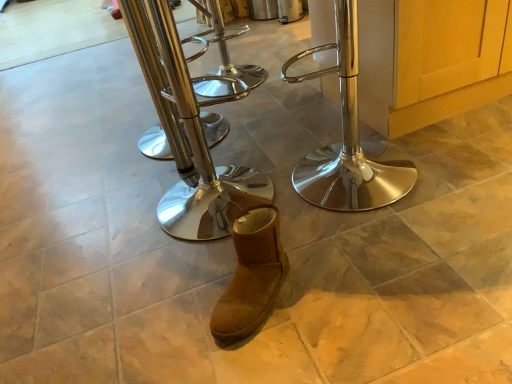
Question: Which direction should I rotate to face polished chrome stool at center, the second step stool when ordered from left to right, — up or down?

Choices:
 (A) up
 (B) down

Answer: (A)

Question: Is polished chrome stool at center, the second step stool viewed from the right, facing towards polished metal bar stool at center, which is the 1th step stool from left to right?

Choices:
 (A) no
 (B) yes

Answer: (A)

Question: Considering the relative positions of polished chrome stool at center, the second step stool viewed from the right, and polished metal bar stool at center, the third step stool viewed from the right, in the image provided, is polished chrome stool at center, the second step stool viewed from the right, to the left of polished metal bar stool at center, the third step stool viewed from the right, from the viewer's perspective?

Choices:
 (A) yes
 (B) no

Answer: (B)

Question: From the image's perspective, would you say polished chrome stool at center, the second step stool viewed from the right, is shown under polished metal bar stool at center, which is the 1th step stool from left to right?

Choices:
 (A) yes
 (B) no

Answer: (A)

Question: Is polished chrome stool at center, the second step stool when ordered from left to right, bigger than polished metal bar stool at center, which is the 1th step stool from left to right?

Choices:
 (A) no
 (B) yes

Answer: (A)

Question: Are polished chrome stool at center, the second step stool viewed from the right, and polished metal bar stool at center, the third step stool viewed from the right, located far from each other?

Choices:
 (A) yes
 (B) no

Answer: (B)

Question: Is polished metal bar stool at center, which is the 1th step stool from left to right, inside polished chrome stool at center, the second step stool when ordered from left to right?

Choices:
 (A) no
 (B) yes

Answer: (A)

Question: Does polished chrome stool at center, which appears as the 1th step stool when viewed from the right, have a smaller size compared to brown suede boot at center?

Choices:
 (A) yes
 (B) no

Answer: (B)

Question: Can you confirm if polished chrome stool at center, which ranks as the 3th step stool in left-to-right order, is wider than brown suede boot at center?

Choices:
 (A) yes
 (B) no

Answer: (A)

Question: Can you see polished chrome stool at center, which appears as the 1th step stool when viewed from the right, touching brown suede boot at center?

Choices:
 (A) yes
 (B) no

Answer: (B)

Question: From a real-world perspective, is polished chrome stool at center, which appears as the 1th step stool when viewed from the right, physically below brown suede boot at center?

Choices:
 (A) yes
 (B) no

Answer: (B)

Question: Is polished chrome stool at center, which appears as the 1th step stool when viewed from the right, aimed at brown suede boot at center?

Choices:
 (A) no
 (B) yes

Answer: (A)

Question: Is polished chrome stool at center, which appears as the 1th step stool when viewed from the right, shorter than brown suede boot at center?

Choices:
 (A) yes
 (B) no

Answer: (B)

Question: From a real-world perspective, is brown suede boot at center below polished chrome stool at center, the second step stool when ordered from left to right?

Choices:
 (A) no
 (B) yes

Answer: (B)